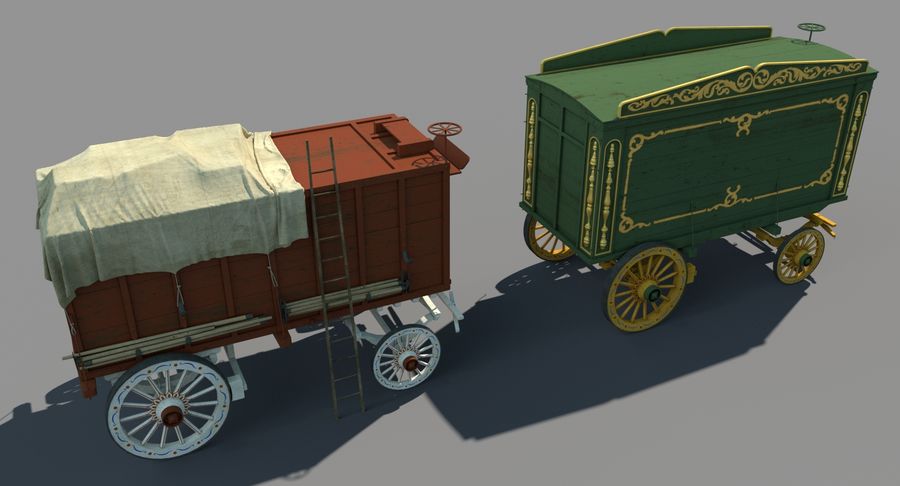
The height and width of the screenshot is (486, 900). Find the location of `ladder`. ladder is located at coordinates (328, 340).